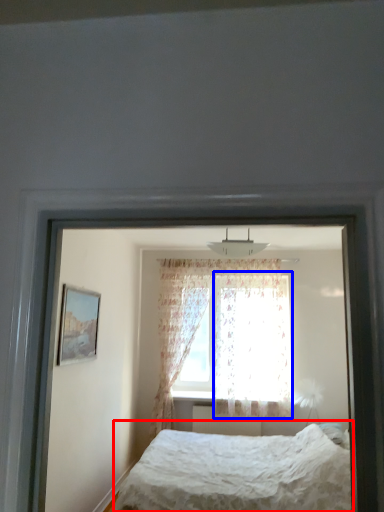
Question: Which object appears closest to the camera in this image, bed (highlighted by a red box) or curtain (highlighted by a blue box)?

Choices:
 (A) bed
 (B) curtain

Answer: (A)